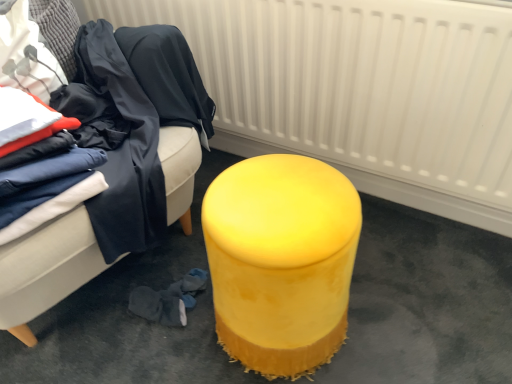
Question: From the image's perspective, is dark blue fabric at left above white textured radiator at upper center?

Choices:
 (A) yes
 (B) no

Answer: (B)

Question: Are dark blue fabric at left and white textured radiator at upper center beside each other?

Choices:
 (A) no
 (B) yes

Answer: (A)

Question: Is dark blue fabric at left positioned in front of white textured radiator at upper center?

Choices:
 (A) yes
 (B) no

Answer: (B)

Question: Is dark blue fabric at left not within white textured radiator at upper center?

Choices:
 (A) no
 (B) yes

Answer: (B)

Question: From a real-world perspective, is dark blue fabric at left on white textured radiator at upper center?

Choices:
 (A) yes
 (B) no

Answer: (A)

Question: Would you say white textured radiator at upper center is part of dark blue fabric at left's contents?

Choices:
 (A) no
 (B) yes

Answer: (A)

Question: Is yellow velvet ottoman at center completely or partially inside dark blue fabric at left?

Choices:
 (A) no
 (B) yes

Answer: (A)

Question: Is dark blue fabric at left at the left side of yellow velvet ottoman at center?

Choices:
 (A) no
 (B) yes

Answer: (B)

Question: Is dark blue fabric at left looking in the opposite direction of yellow velvet ottoman at center?

Choices:
 (A) yes
 (B) no

Answer: (B)

Question: Can you confirm if dark blue fabric at left is positioned to the right of yellow velvet ottoman at center?

Choices:
 (A) yes
 (B) no

Answer: (B)

Question: Is dark blue fabric at left in front of yellow velvet ottoman at center?

Choices:
 (A) yes
 (B) no

Answer: (B)

Question: Considering the relative sizes of dark blue fabric at left and yellow velvet ottoman at center in the image provided, is dark blue fabric at left wider than yellow velvet ottoman at center?

Choices:
 (A) yes
 (B) no

Answer: (B)

Question: From a real-world perspective, is velvet yellow ottoman at right located beneath dark blue fabric at left?

Choices:
 (A) yes
 (B) no

Answer: (A)